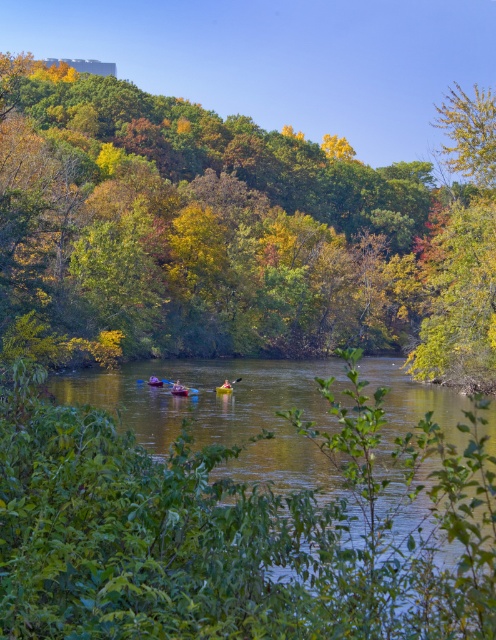
Does green leafy tree at center come in front of wooden paddle at center?

Yes, it is.

Is green leafy tree at center bigger than wooden paddle at center?

Yes, green leafy tree at center is bigger than wooden paddle at center.

Is point (332, 262) more distant than point (173, 384)?

That is True.

Where is `green leafy tree at center`? The width and height of the screenshot is (496, 640). green leafy tree at center is located at coordinates 238,228.

Can you confirm if green smooth water at center is positioned above wooden paddle at center?

Correct, green smooth water at center is located above wooden paddle at center.

Which is in front, point (347, 554) or point (176, 388)?

Point (347, 554) is more forward.

Between point (414, 444) and point (169, 381), which one is positioned in front?

Point (414, 444) is in front.

Find the location of a particular element. The image size is (496, 640). green smooth water at center is located at coordinates (321, 506).

Does green leafy tree at center have a larger size compared to green smooth water at center?

Correct, green leafy tree at center is larger in size than green smooth water at center.

Can you confirm if green leafy tree at center is smaller than green smooth water at center?

Actually, green leafy tree at center might be larger than green smooth water at center.

Find the location of `green leafy tree at center`. green leafy tree at center is located at coordinates (238, 228).